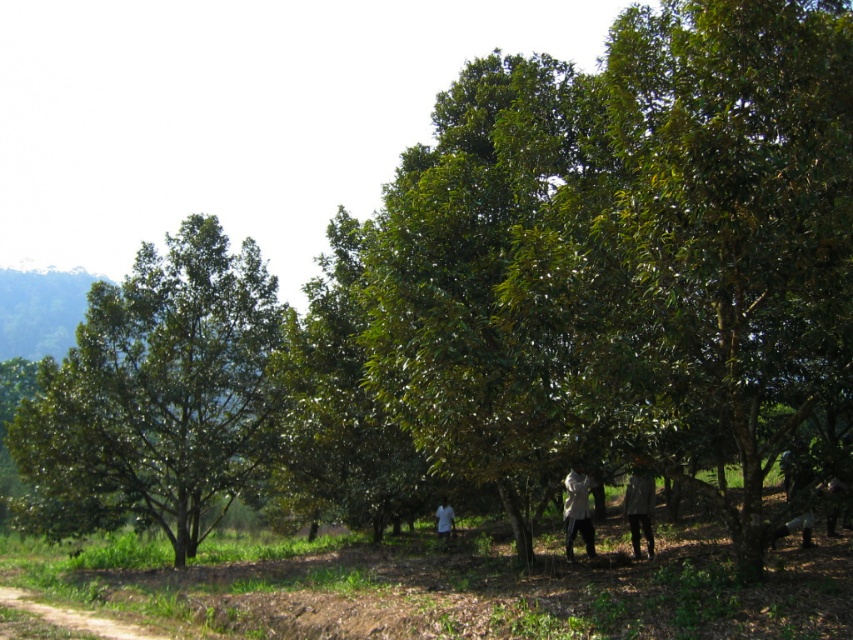
Is dark gray coat at center to the left of white fabric coat at center from the viewer's perspective?

In fact, dark gray coat at center is to the right of white fabric coat at center.

Can you confirm if dark gray coat at center is smaller than white fabric coat at center?

Yes, dark gray coat at center is smaller than white fabric coat at center.

Is point (631, 502) positioned before point (566, 499)?

Yes, it is.

I want to click on dark gray coat at center, so click(x=639, y=506).

Is green leafy tree at left below white fabric shirt at center?

Actually, green leafy tree at left is above white fabric shirt at center.

Is green leafy tree at left closer to camera compared to white fabric shirt at center?

Yes.

Which is behind, point (248, 300) or point (450, 513)?

The point (450, 513) is behind.

Identify the location of green leafy tree at left. This screenshot has height=640, width=853. (155, 394).

Does dark gray coat at center have a lesser height compared to white fabric shirt at center?

No.

Does dark gray coat at center appear over white fabric shirt at center?

Yes.

Does point (639, 467) lie in front of point (450, 522)?

Yes, it is in front of point (450, 522).

Locate an element on the screen. The height and width of the screenshot is (640, 853). dark gray coat at center is located at coordinates coord(639,506).